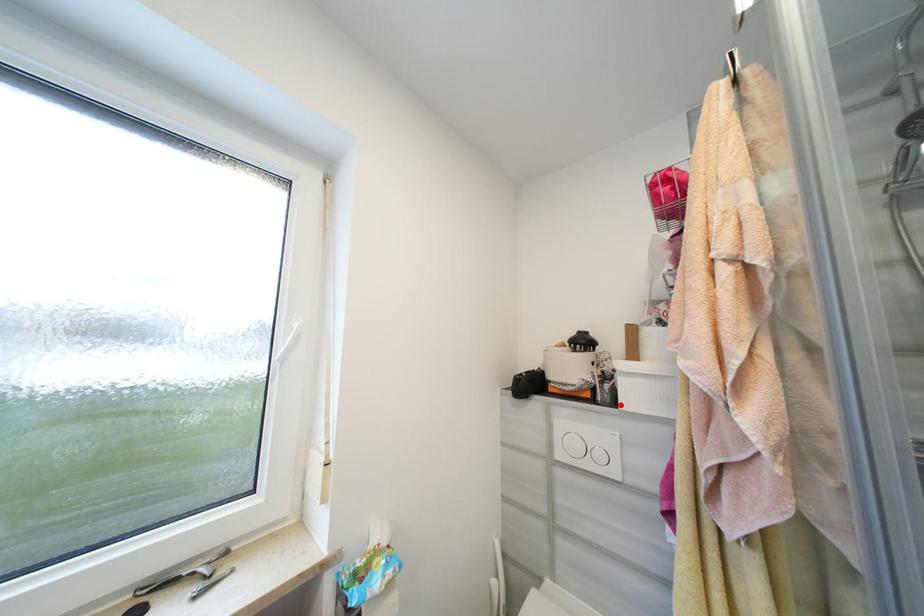
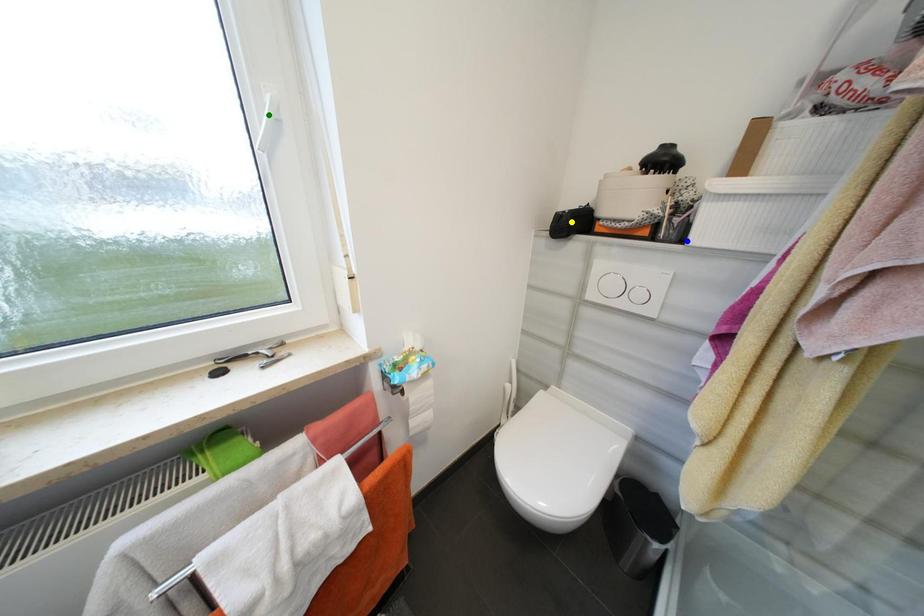
Question: I am providing you with two images of the same scene from different viewpoints. A red point is marked on the first image. You are given multiple points on the second image. Can you choose the point in image 2 that corresponds to the point in image 1?

Choices:
 (A) green point
 (B) yellow point
 (C) blue point

Answer: (C)